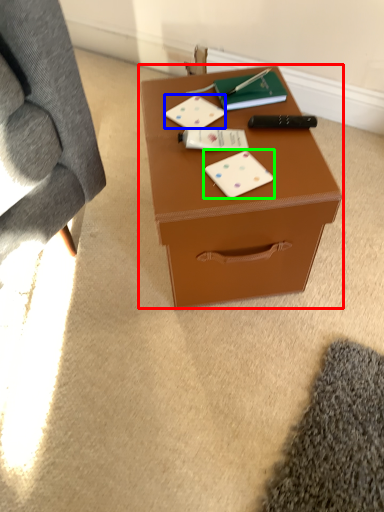
Question: Considering the real-world distances, which object is farthest from table (highlighted by a red box)? card game (highlighted by a blue box) or card game (highlighted by a green box)?

Choices:
 (A) card game
 (B) card game

Answer: (A)